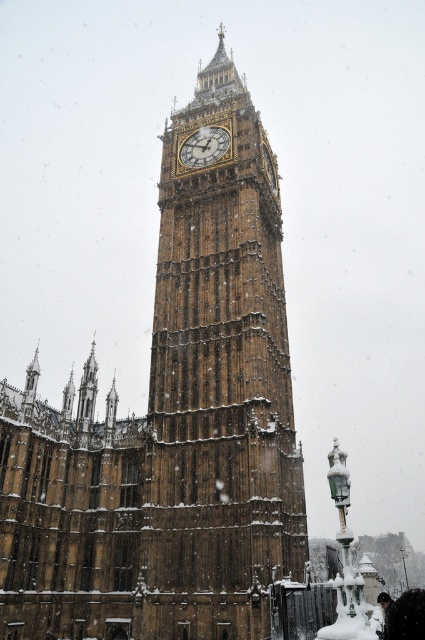
Looking at this image, you are a tourist visiting London and want to take a photo of the brown stone clock tower at center and the gold textured clock at center. Which object should you focus on first if you want to capture both in a single frame without zooming in or out?

You should focus on the brown stone clock tower at center first because it is larger in size compared to the gold textured clock at center, allowing it to be captured in the frame more easily without needing adjustment.

You are standing in front of the brown stone clock tower at center and the gold textured clock at center. Which object is nearer to you?

The brown stone clock tower at center is closer to you than the gold textured clock at center.

You are a tourist standing in front of the brown stone clock tower at center and the gold textured clock at center. Which object is located to the right of the other?

The gold textured clock at center is positioned to the right of the brown stone clock tower at center.